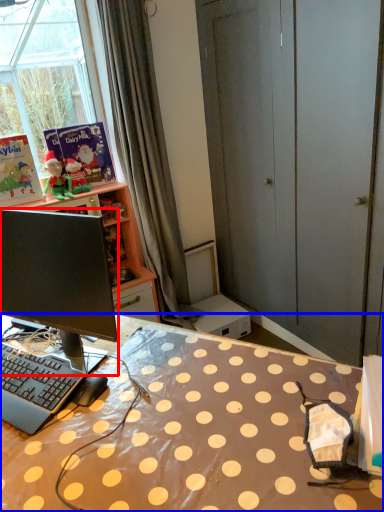
Question: Which object appears farthest to the camera in this image, computer monitor (highlighted by a red box) or desk (highlighted by a blue box)?

Choices:
 (A) computer monitor
 (B) desk

Answer: (A)